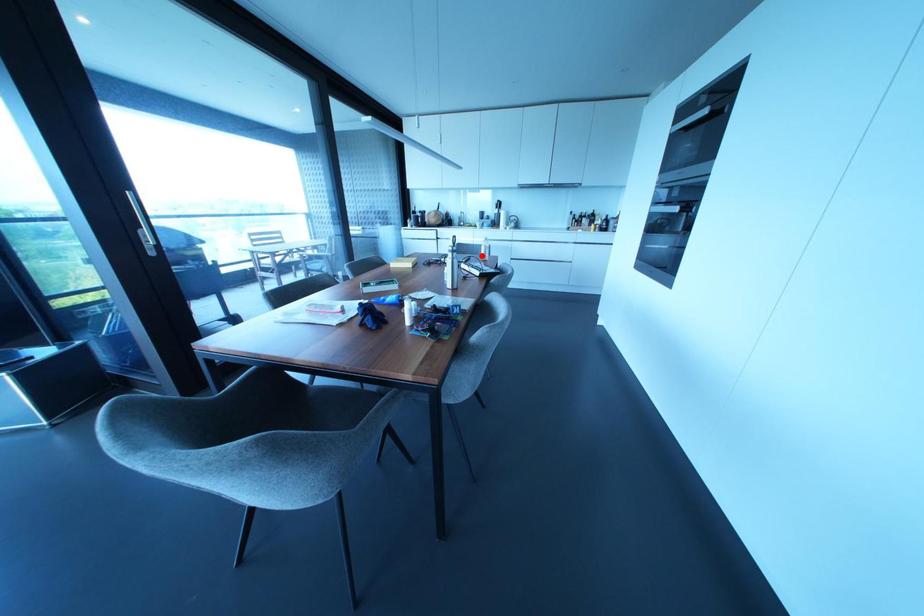
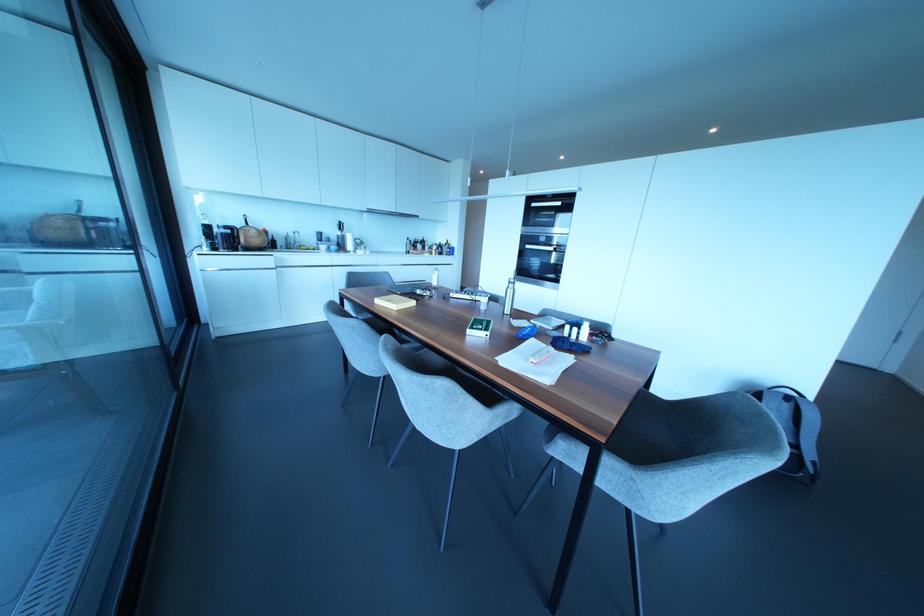
The point at the highlighted location is marked in the first image. Where is the corresponding point in the second image?

(434, 283)